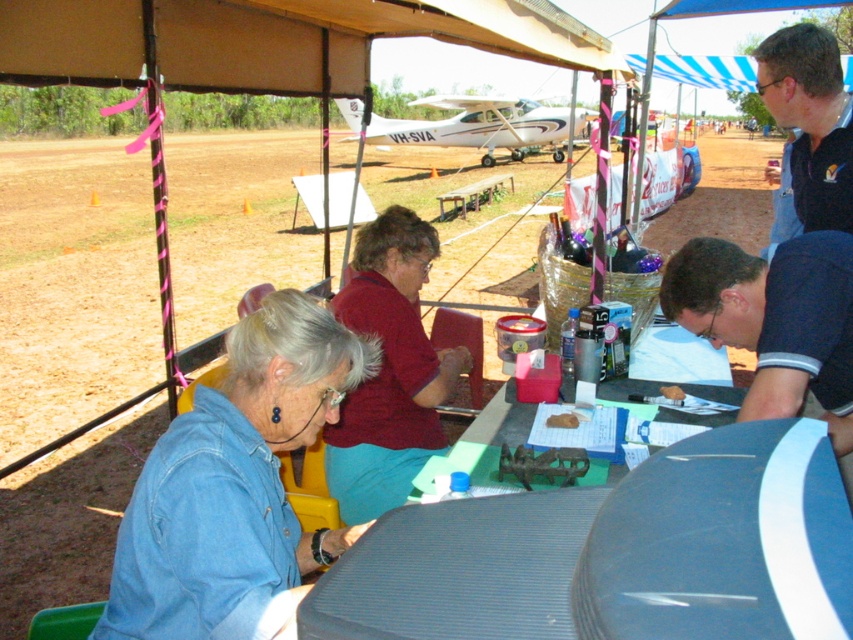
Is point (247, 593) closer to viewer compared to point (506, 422)?

Yes, it is in front of point (506, 422).

Is denim jacket at lower left behind green plastic table at center?

That is False.

Which is in front, point (178, 561) or point (421, 477)?

Point (178, 561) is in front.

Find the location of a particular element. The image size is (853, 640). denim jacket at lower left is located at coordinates (236, 486).

Between denim jacket at lower left and black polo shirt at upper right, which one appears on the left side from the viewer's perspective?

Positioned to the left is denim jacket at lower left.

Is point (251, 454) farther from viewer compared to point (836, 109)?

That is False.

Does point (177, 596) lie in front of point (838, 176)?

Yes, it is.

Where is `denim jacket at lower left`? This screenshot has height=640, width=853. denim jacket at lower left is located at coordinates (236, 486).

Can you confirm if brown crumbly bread at center is positioned above brown crumbly cake at center?

No.

Does point (560, 417) lie behind point (675, 397)?

No, (560, 417) is in front of (675, 397).

Where is `brown crumbly bread at center`? This screenshot has height=640, width=853. brown crumbly bread at center is located at coordinates (561, 420).